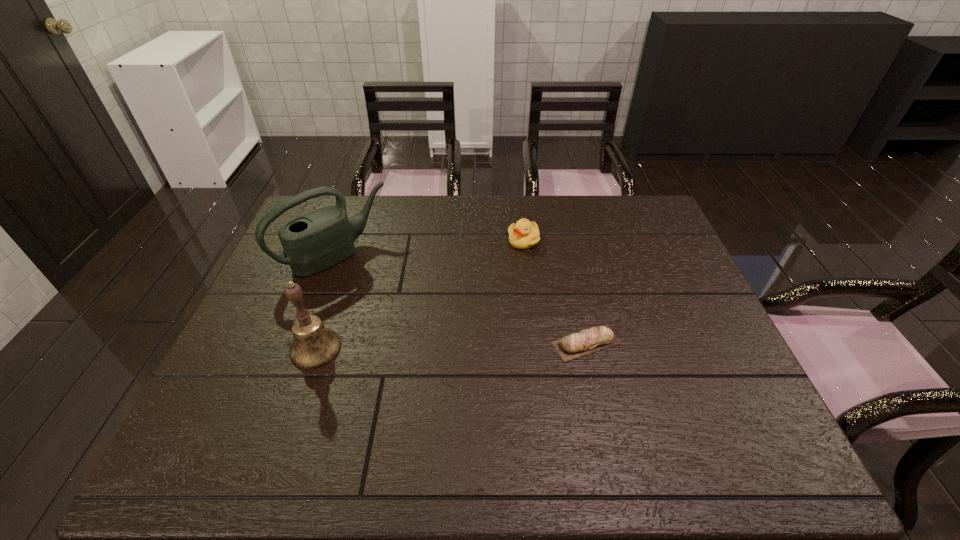
This screenshot has height=540, width=960. What are the coordinates of `bell` in the screenshot? It's located at (314, 345).

The width and height of the screenshot is (960, 540). I want to click on the shortest object, so pos(597,338).

Identify the location of watering can. (318, 240).

Image resolution: width=960 pixels, height=540 pixels. I want to click on duckling, so click(524, 234).

Where is `vacant space positioned on the right of the bell`? The height and width of the screenshot is (540, 960). vacant space positioned on the right of the bell is located at coordinates (487, 348).

Where is `vacant space located 0.220m on the back of the pita bread`? The height and width of the screenshot is (540, 960). vacant space located 0.220m on the back of the pita bread is located at coordinates (570, 268).

Where is `free spot located 0.100m on the spout of the watering can`? This screenshot has height=540, width=960. free spot located 0.100m on the spout of the watering can is located at coordinates (382, 295).

Find the location of a particular element. vacant area located on the spout of the watering can is located at coordinates (401, 313).

Locate an element on the screen. This screenshot has width=960, height=540. vacant space situated 0.070m on the spout of the watering can is located at coordinates (376, 290).

The width and height of the screenshot is (960, 540). Find the location of `free space located at the face of the duckling`. free space located at the face of the duckling is located at coordinates (490, 293).